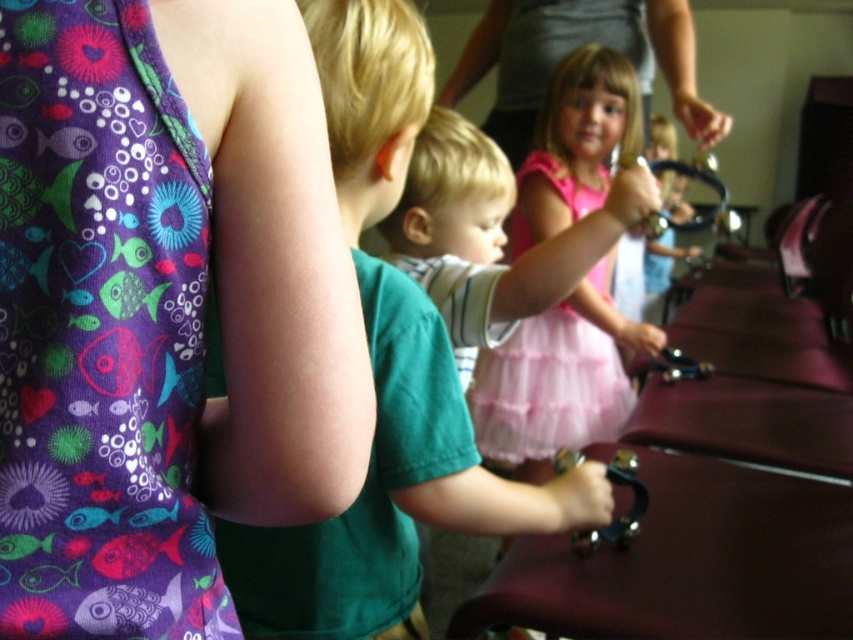
Question: Considering the relative positions of green matte shirt at center and pink tulle skirt at center in the image provided, where is green matte shirt at center located with respect to pink tulle skirt at center?

Choices:
 (A) above
 (B) below

Answer: (B)

Question: Which is nearer to the purple fabric dress at left?

Choices:
 (A) pink tulle dress at center
 (B) green matte shirt at center
 (C) pink tulle skirt at center

Answer: (B)

Question: In this image, where is green matte shirt at center located relative to pink tulle dress at center?

Choices:
 (A) left
 (B) right

Answer: (A)

Question: Considering the real-world distances, which object is farthest from the pink tulle dress at center?

Choices:
 (A) pink tulle skirt at center
 (B) purple fabric dress at left

Answer: (B)

Question: Is purple fabric dress at left positioned in front of pink tulle dress at center?

Choices:
 (A) no
 (B) yes

Answer: (B)

Question: Which object is the closest to the purple fabric dress at left?

Choices:
 (A) pink tulle skirt at center
 (B) pink tulle dress at center
 (C) green matte shirt at center

Answer: (C)